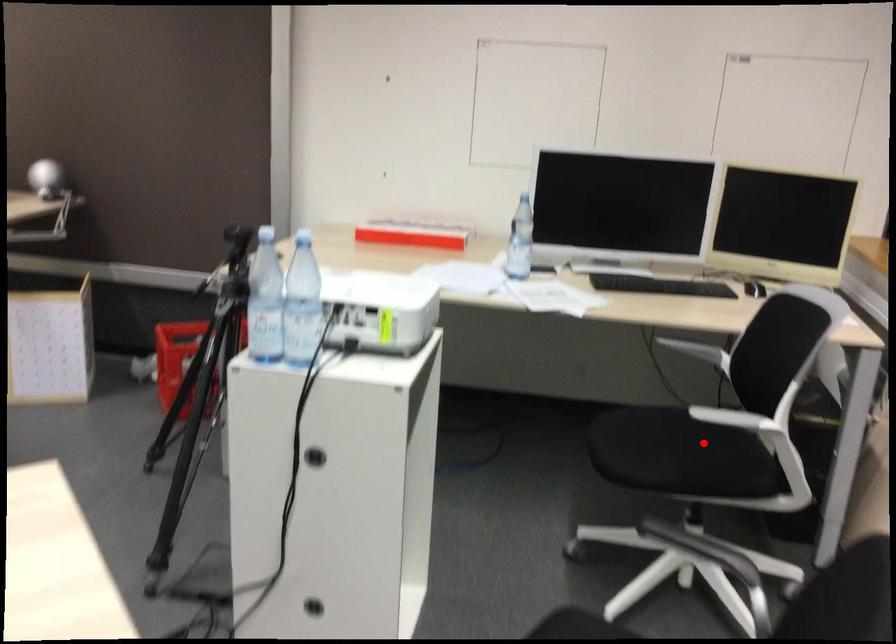
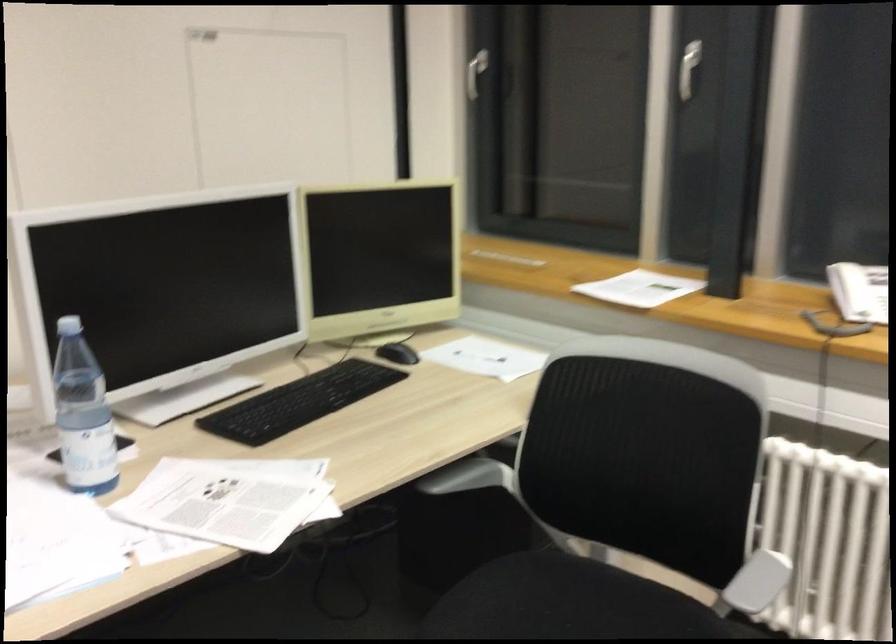
Find the pixel in the second image that matches the highlighted location in the first image.

(570, 603)